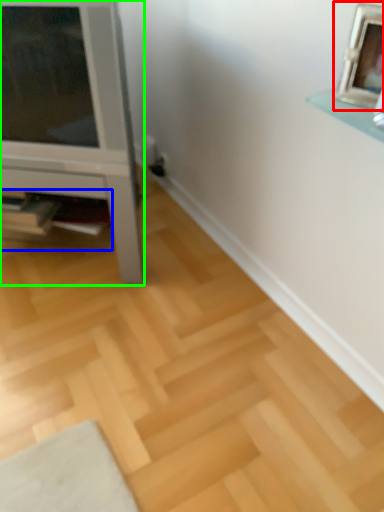
Question: Estimate the real-world distances between objects in this image. Which object is farther from picture frame (highlighted by a red box), shelf (highlighted by a blue box) or furniture (highlighted by a green box)?

Choices:
 (A) shelf
 (B) furniture

Answer: (A)